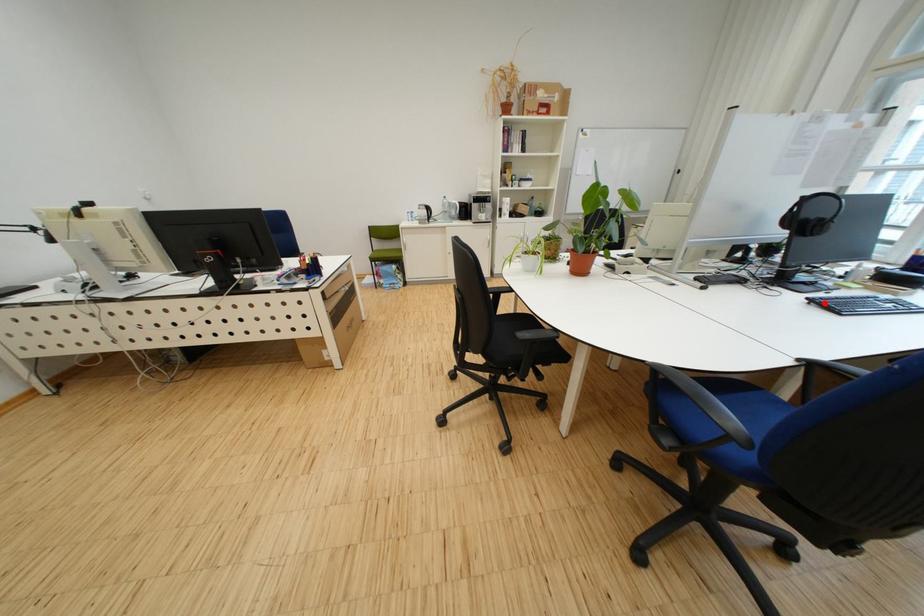
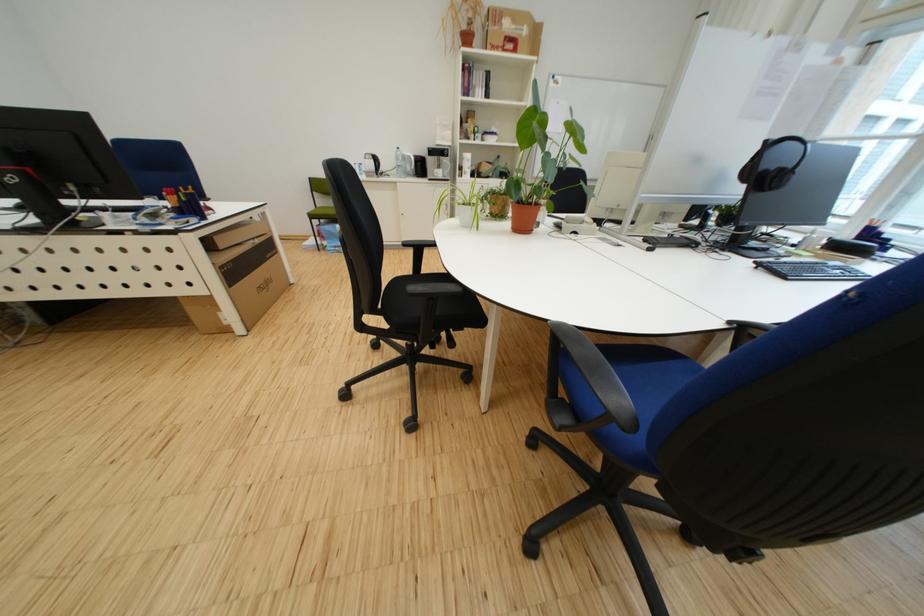
Question: I am providing you with two images of the same scene from different viewpoints. A red point is marked on the first image. Can you still see the location of the red point in image 2?

Choices:
 (A) Yes
 (B) No

Answer: (A)